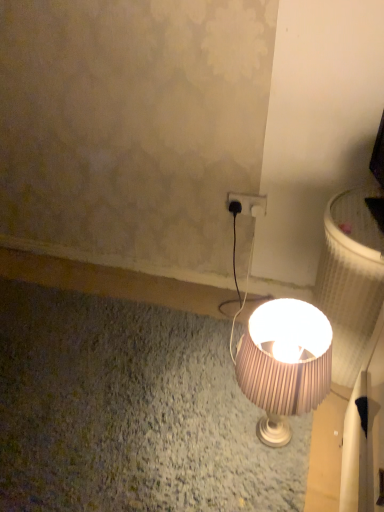
Question: From a real-world perspective, is black plastic plug at center physically located above or below matte brown lampshade at center?

Choices:
 (A) above
 (B) below

Answer: (A)

Question: From the image's perspective, is black plastic plug at center positioned above or below matte brown lampshade at center?

Choices:
 (A) below
 (B) above

Answer: (B)

Question: Which object is positioned closest to the black plastic power plug at upper right?

Choices:
 (A) matte brown lampshade at center
 (B) black plastic plug at center

Answer: (B)

Question: Based on their relative distances, which object is nearer to the black plastic power plug at upper right?

Choices:
 (A) matte brown lampshade at center
 (B) black plastic plug at center

Answer: (B)